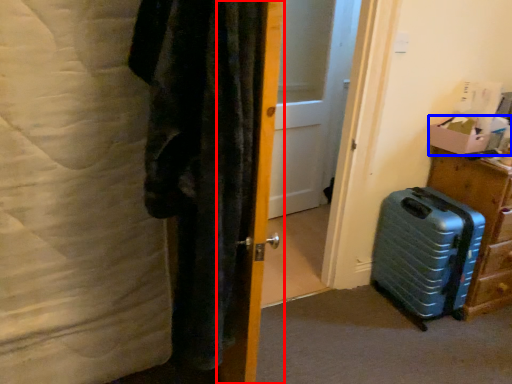
Question: Among these objects, which one is farthest to the camera, door (highlighted by a red box) or box (highlighted by a blue box)?

Choices:
 (A) door
 (B) box

Answer: (B)